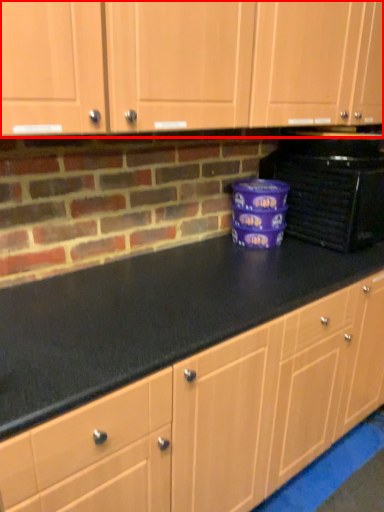
Question: From the image's perspective, considering the relative positions of cabinetry (annotated by the red box) and home appliance in the image provided, where is cabinetry (annotated by the red box) located with respect to the staircase?

Choices:
 (A) above
 (B) below

Answer: (A)